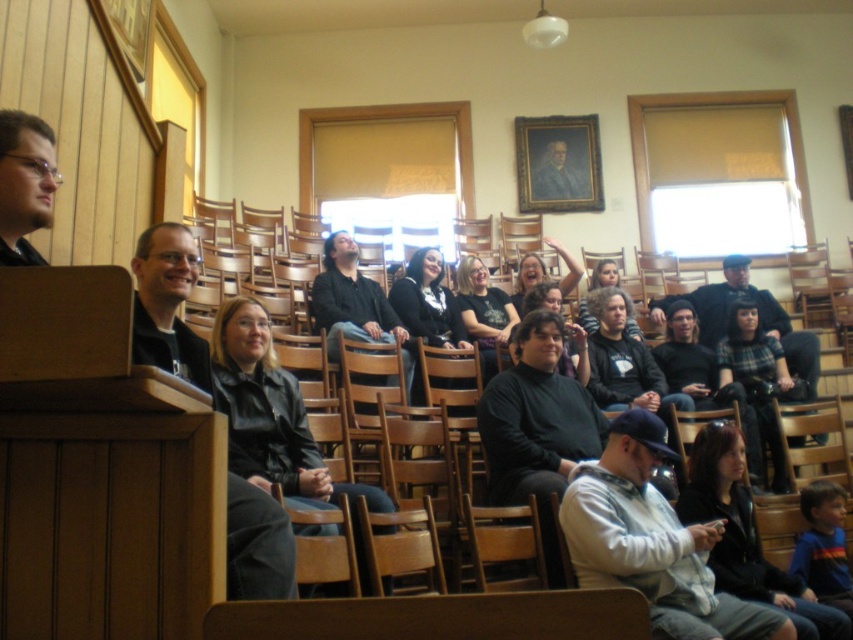
Question: Which object is positioned closest to the matte black shirt at center?

Choices:
 (A) plaid wool sweater at center
 (B) dark gray sweater at lower right
 (C) matte black jacket at left
 (D) light gray hoodie at center

Answer: (A)

Question: Which object is farther from the camera taking this photo?

Choices:
 (A) dark gray knit sweater at center
 (B) plaid wool sweater at center

Answer: (A)

Question: Is dark gray sweater at lower right positioned behind black matte shirt at center?

Choices:
 (A) yes
 (B) no

Answer: (B)

Question: Where is light gray hoodie at center located in relation to matte black jacket at left in the image?

Choices:
 (A) right
 (B) left

Answer: (A)

Question: Which point is closer to the camera?

Choices:
 (A) black leather jacket at center
 (B) matte black shirt at center
 (C) dark gray knit sweater at center

Answer: (A)

Question: Considering the relative positions of black matte shirt at center and dark gray knit sweater at center in the image provided, where is black matte shirt at center located with respect to dark gray knit sweater at center?

Choices:
 (A) right
 (B) left

Answer: (B)